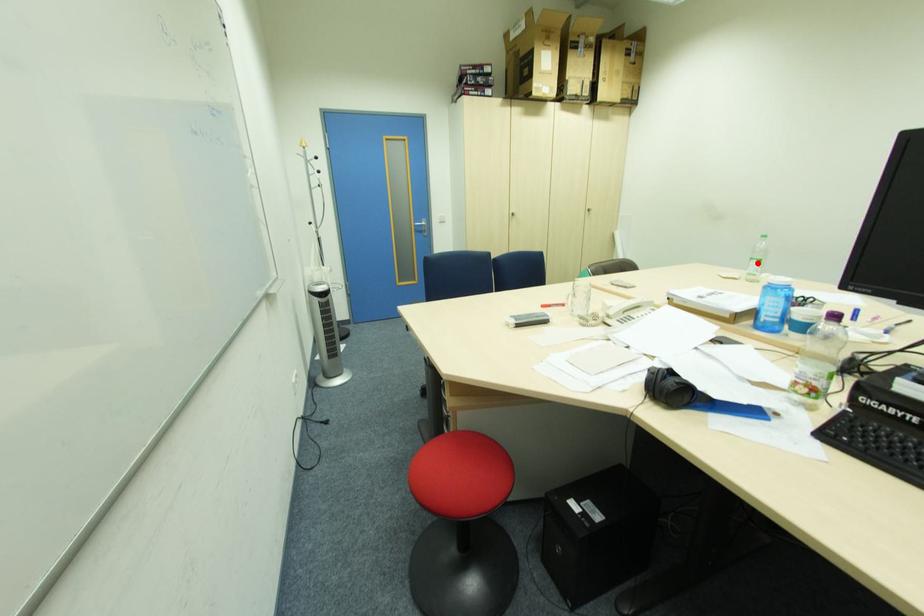
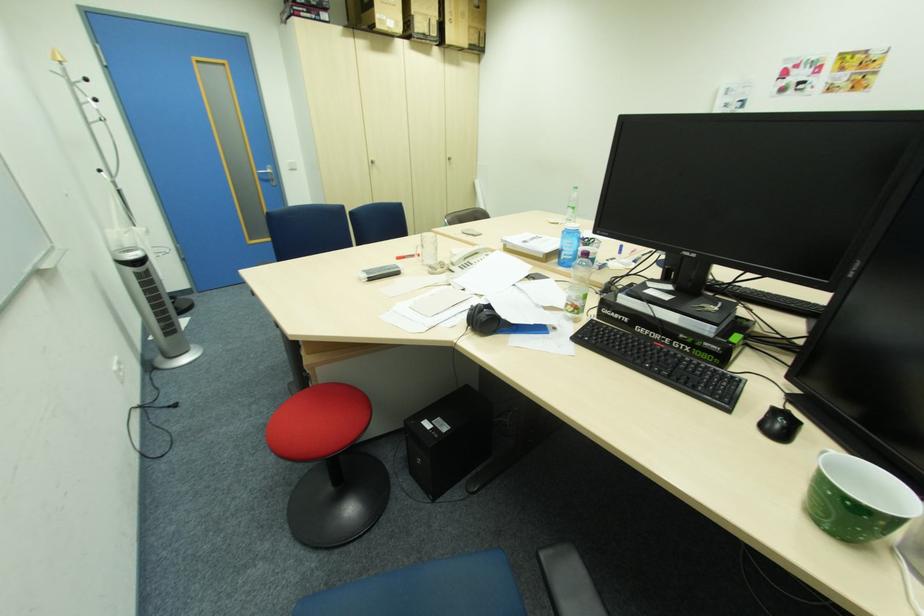
The point at the highlighted location is marked in the first image. Where is the corresponding point in the second image?

(574, 209)